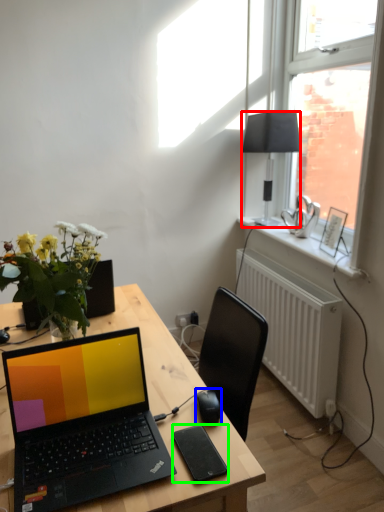
Question: Which object is the closest to the lamp (highlighted by a red box)? Choose among these: computer mouse (highlighted by a blue box) or tablet computer (highlighted by a green box).

Choices:
 (A) computer mouse
 (B) tablet computer

Answer: (A)